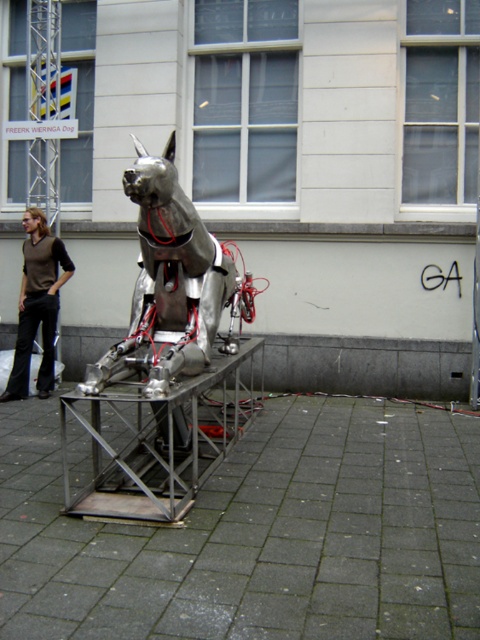
In the scene shown: Is shiny metallic dog at center positioned at the back of brownmaterial/texturevest at left?

No, shiny metallic dog at center is in front of brownmaterial/texturevest at left.

Can you confirm if shiny metallic dog at center is positioned to the left of brownmaterial/texturevest at left?

No, shiny metallic dog at center is not to the left of brownmaterial/texturevest at left.

Is point (190, 280) closer to camera compared to point (15, 385)?

Yes, it is.

The height and width of the screenshot is (640, 480). In order to click on shiny metallic dog at center in this screenshot , I will do `click(169, 289)`.